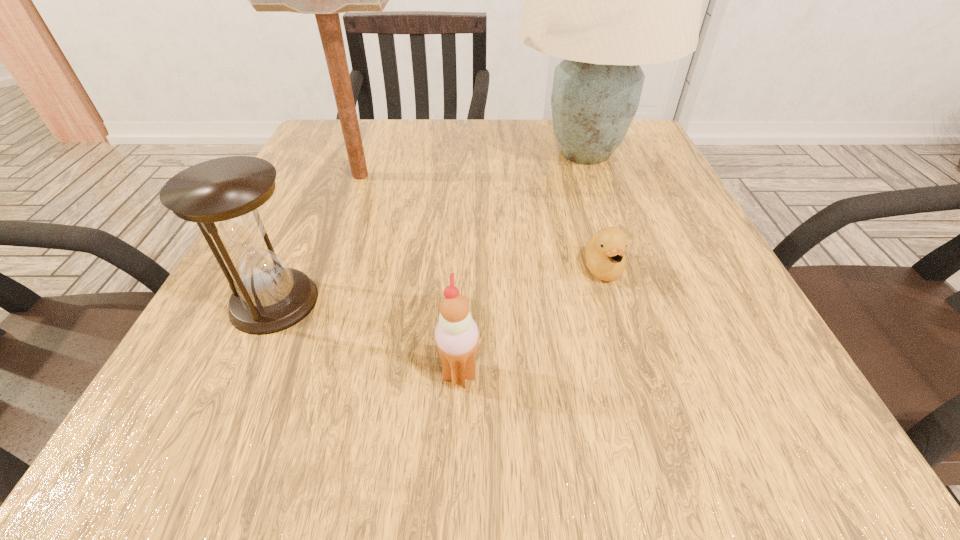
I want to click on vacant area that lies between the shortest object and the lampshade, so click(594, 211).

Image resolution: width=960 pixels, height=540 pixels. Find the location of `blank region between the hourglass and the tallest object`. blank region between the hourglass and the tallest object is located at coordinates (429, 227).

This screenshot has height=540, width=960. I want to click on blank region between the lampshade and the icecream, so click(x=522, y=264).

In order to click on free space between the icecream and the tallest object in this screenshot , I will do `click(522, 264)`.

I want to click on object that is the fourth nearest to the tallest object, so click(x=456, y=334).

You are a GUI agent. You are given a task and a screenshot of the screen. Output one action in this format:
    pyautogui.click(x=<x>, y=<y>)
    Task: Click on the object that stands as the fourth closest to the third tallest object
    This screenshot has width=960, height=540.
    Given the screenshot: What is the action you would take?
    pyautogui.click(x=605, y=258)

At what (x,y) coordinates should I click in order to perform the action: click on vacant area that satisfies the following two spatial constraints: 1. on the front side of the tallest object; 2. at the front with a straw on the second shortest object. Please return your answer as a coordinate pair (x, y). This screenshot has height=540, width=960. Looking at the image, I should click on (661, 375).

Locate an element on the screen. The image size is (960, 540). blank area in the image that satisfies the following two spatial constraints: 1. on the face of the shortest object; 2. at the front with a straw on the nearest object is located at coordinates (635, 375).

Locate an element on the screen. The image size is (960, 540). vacant position in the image that satisfies the following two spatial constraints: 1. on the front side of the tallest object; 2. on the striking face of the second tallest object is located at coordinates (592, 176).